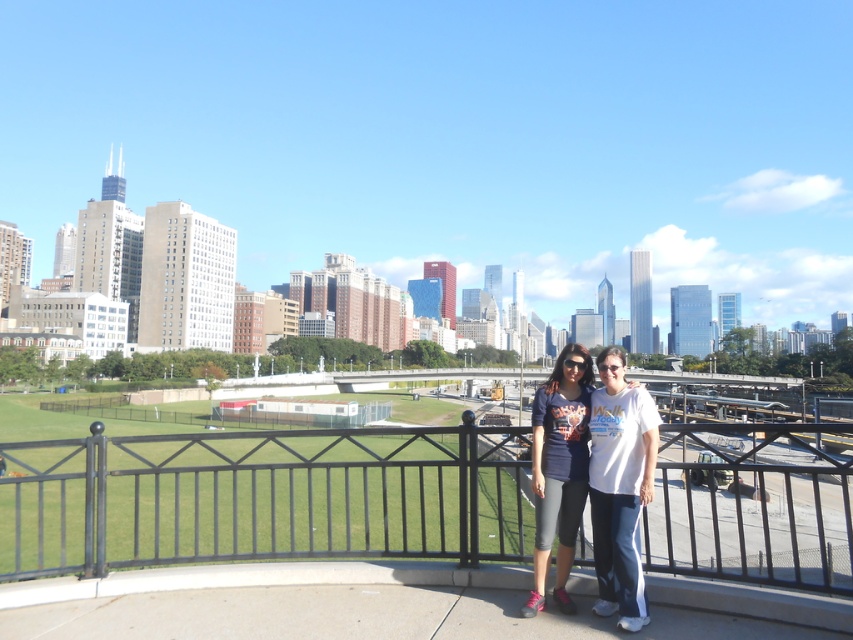
Question: From the image, what is the correct spatial relationship of black metal fence at center in relation to matte blue shirt at center?

Choices:
 (A) above
 (B) below

Answer: (B)

Question: Is black metal fence at center positioned before matte blue shirt at center?

Choices:
 (A) no
 (B) yes

Answer: (B)

Question: Does black metal fence at center appear on the left side of matte blue shirt at center?

Choices:
 (A) yes
 (B) no

Answer: (A)